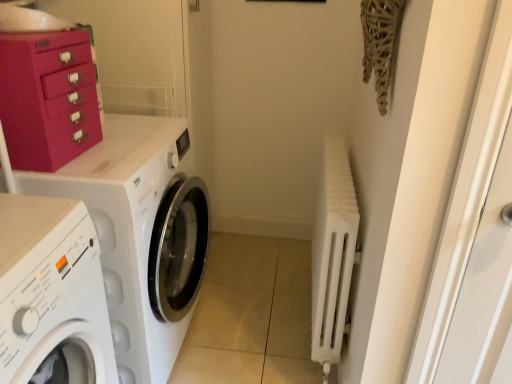
I want to click on vacant position to the left of white matte radiator at right, so click(x=248, y=321).